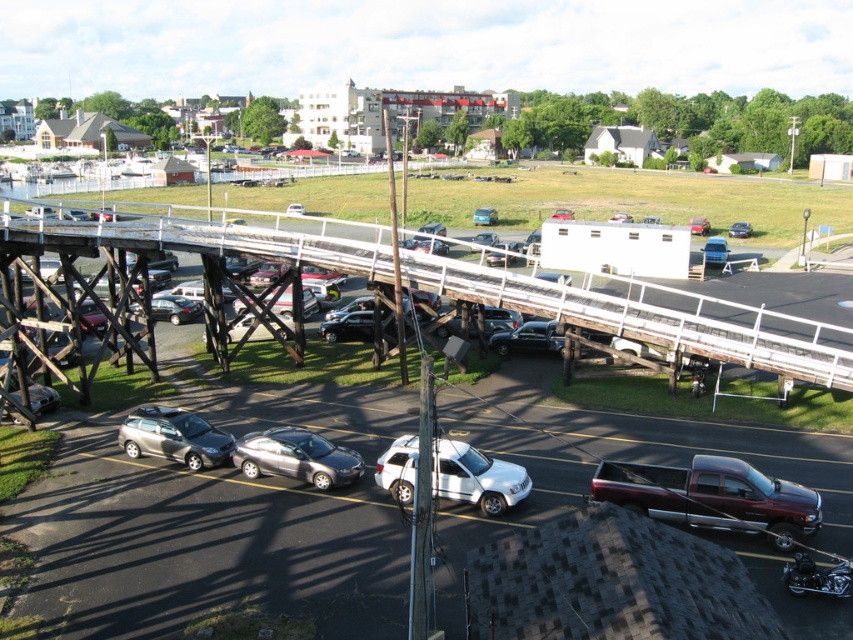
Question: Which of these objects is positioned farthest from the metallic silver sedan at center-right?

Choices:
 (A) metallic maroon truck at lower right
 (B) wooden bridge at center
 (C) satin black sedan at center
 (D) satin silver suv at lower left

Answer: (D)

Question: Which point appears closest to the camera in this image?

Choices:
 (A) (132, 246)
 (B) (700, 221)
 (C) (737, 232)
 (D) (323, 461)

Answer: (D)

Question: Can you confirm if satin black sedan at center is positioned to the left of metallic red car at center?

Choices:
 (A) yes
 (B) no

Answer: (B)

Question: Is metallic silver sedan at center-right to the right of metallic red car at center from the viewer's perspective?

Choices:
 (A) yes
 (B) no

Answer: (B)

Question: Is white matte suv at center below satin silver suv at lower left?

Choices:
 (A) yes
 (B) no

Answer: (A)

Question: Which point appears closest to the camera in this image?

Choices:
 (A) (450, 275)
 (B) (712, 237)
 (C) (740, 468)
 (D) (151, 422)

Answer: (C)